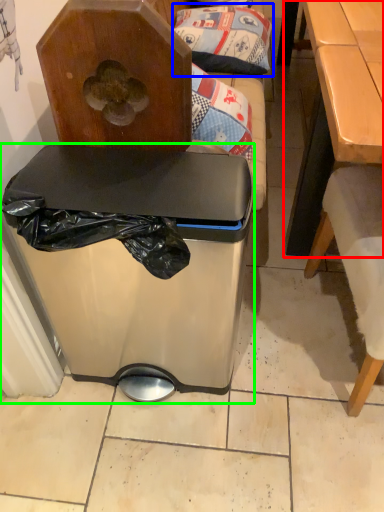
Question: Considering the real-world distances, which object is farthest from table (highlighted by a red box)? pillow (highlighted by a blue box) or trash bin/can (highlighted by a green box)?

Choices:
 (A) pillow
 (B) trash bin/can

Answer: (B)